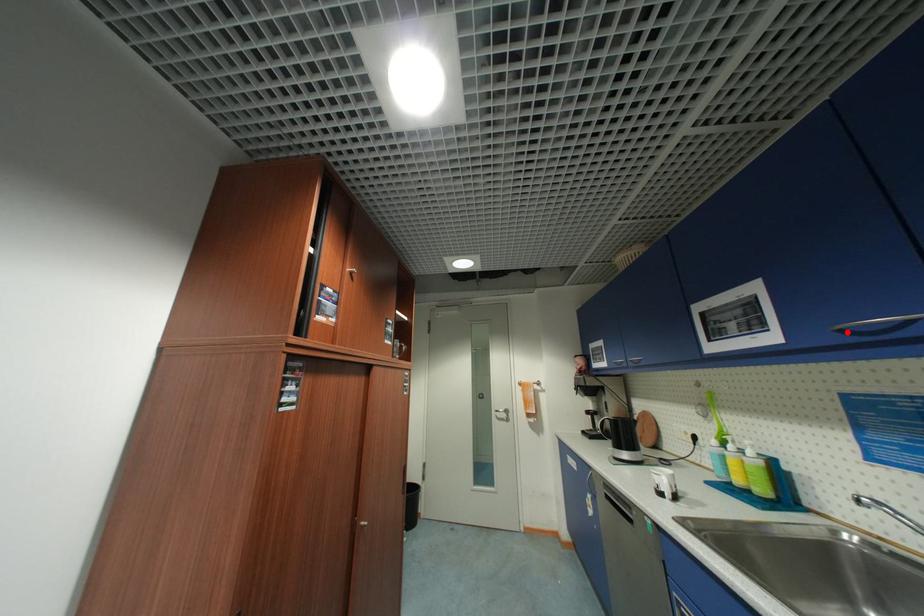
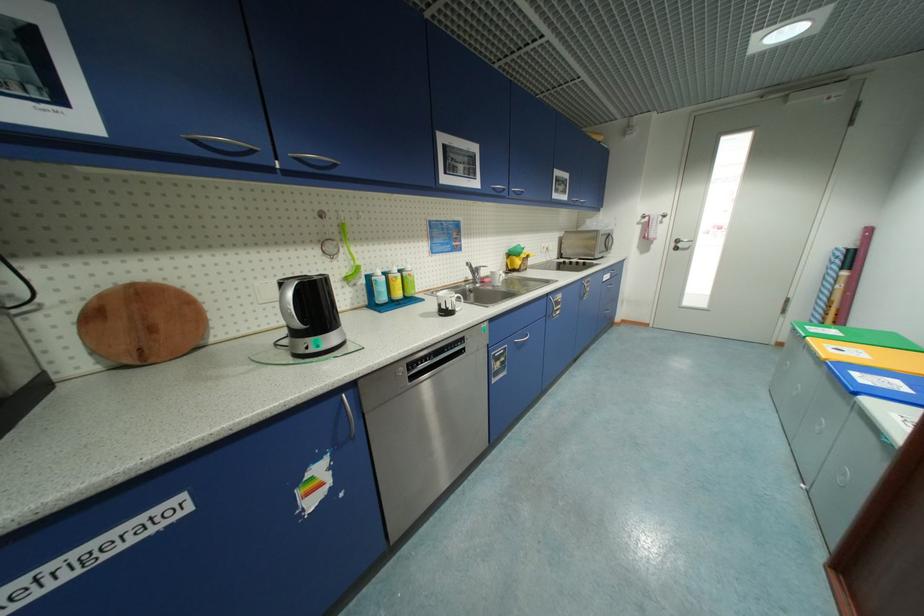
Where in the second image is the point corresponding to the highlighted location from the first image?

(499, 190)